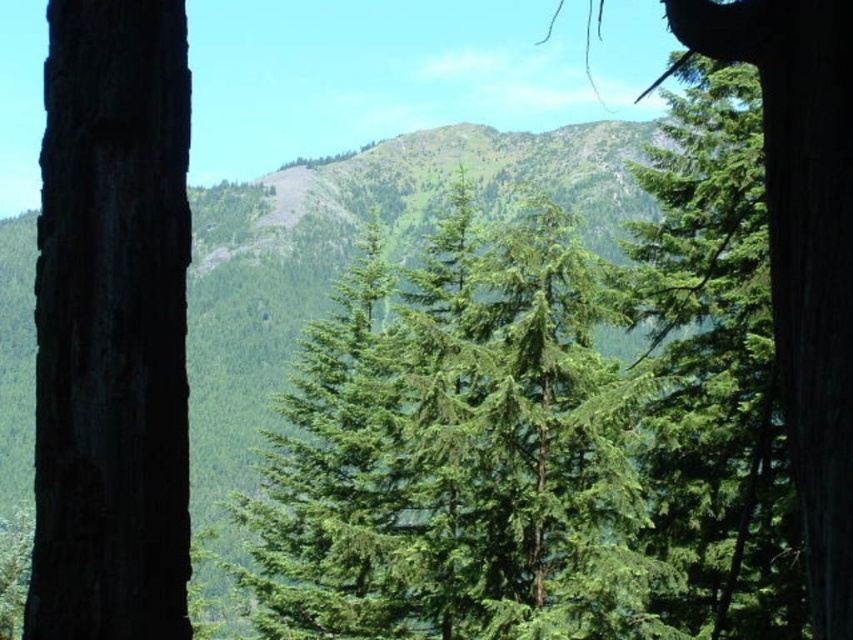
You are standing in front of the window frame formed by the two tree trunks and want to place a small decoration. You have two points marked on the window frame at point coordinates point (576, 339) and point (155, 497). Which point is closer to you so that the decoration will be more visible?

Point (155, 497) is closer to you than point (576, 339), so placing the decoration there would make it more visible.